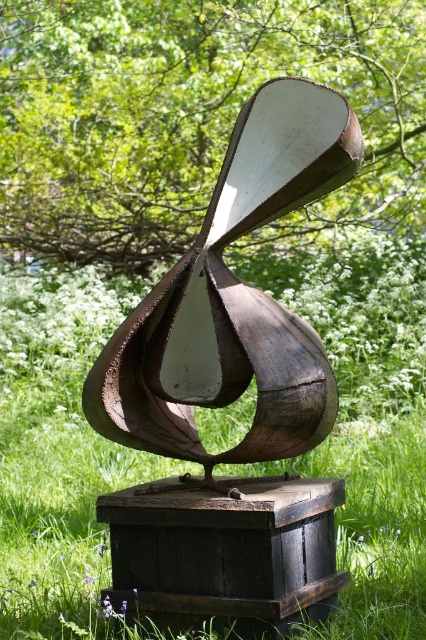
You are an art installer who needs to secure the brown wooden sculpture at center to its base. According to the sculpture design, where exactly should you attach the sculpture relative to the dark brown wooden box at center?

The brown wooden sculpture at center is above the dark brown wooden box at center, so you should attach it on top of the dark brown wooden box at center.

You are an artist planning to move the sculpture to a new location. The entrance of the new location has a doorway that is 1.2 meters wide. Given that the rusty metal abstract at center and dark brown wooden box at center are part of the sculpture, will the entire sculpture fit through the doorway?

The rusty metal abstract at center has a larger width than the dark brown wooden box at center. Since the doorway is 1.2 meters wide, we need to check the width of the widest part of the sculpture. If the rusty metal abstract at center is wider than 1.2 meters, it won but if it exceeds, it won